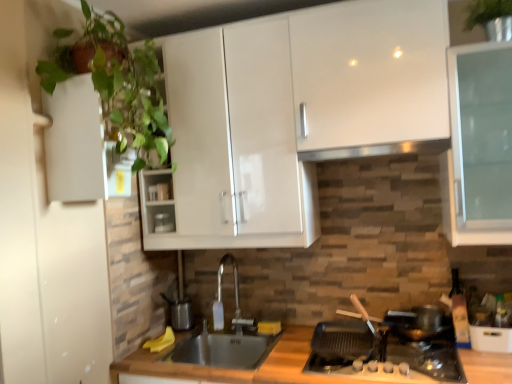
Question: From the image's perspective, is matte white container at center below green leafy plant at left?

Choices:
 (A) no
 (B) yes

Answer: (B)

Question: Can you confirm if matte white container at center is thinner than green leafy plant at left?

Choices:
 (A) yes
 (B) no

Answer: (A)

Question: Is matte white container at center next to green leafy plant at left and touching it?

Choices:
 (A) no
 (B) yes

Answer: (A)

Question: Is matte white container at center to the left of green leafy plant at left from the viewer's perspective?

Choices:
 (A) no
 (B) yes

Answer: (A)

Question: Is matte white container at center positioned beyond the bounds of green leafy plant at left?

Choices:
 (A) yes
 (B) no

Answer: (A)

Question: Does matte white container at center have a greater height compared to green leafy plant at left?

Choices:
 (A) no
 (B) yes

Answer: (A)

Question: Are green leafy plant at left and black glass gas stove at lower right beside each other?

Choices:
 (A) no
 (B) yes

Answer: (A)

Question: Is green leafy plant at left aimed at black glass gas stove at lower right?

Choices:
 (A) yes
 (B) no

Answer: (B)

Question: Is green leafy plant at left to the left of black glass gas stove at lower right from the viewer's perspective?

Choices:
 (A) no
 (B) yes

Answer: (B)

Question: From a real-world perspective, is green leafy plant at left positioned under black glass gas stove at lower right based on gravity?

Choices:
 (A) yes
 (B) no

Answer: (B)

Question: Is the position of green leafy plant at left more distant than that of black glass gas stove at lower right?

Choices:
 (A) no
 (B) yes

Answer: (A)

Question: Can we say green leafy plant at left lies outside black glass gas stove at lower right?

Choices:
 (A) yes
 (B) no

Answer: (A)

Question: Can we say black stainless steel sink at center lies outside stainless steel exhaust hood at upper center?

Choices:
 (A) yes
 (B) no

Answer: (A)